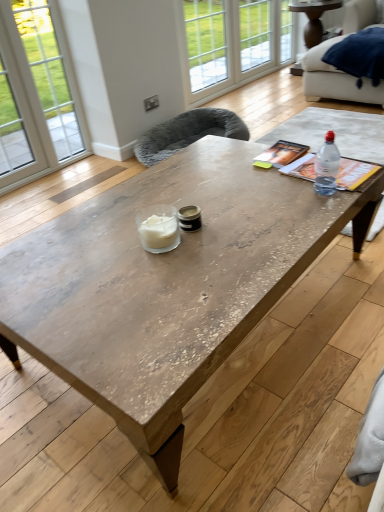
Question: Can you confirm if rustic wood coffee table at center is thinner than clear glass window at upper center, which ranks as the third window in left-to-right order?

Choices:
 (A) yes
 (B) no

Answer: (B)

Question: From the image's perspective, does rustic wood coffee table at center appear lower than clear glass window at upper center, which appears as the first window when viewed from the right?

Choices:
 (A) no
 (B) yes

Answer: (B)

Question: Does rustic wood coffee table at center touch clear glass window at upper center, which ranks as the third window in left-to-right order?

Choices:
 (A) no
 (B) yes

Answer: (A)

Question: Can you confirm if rustic wood coffee table at center is bigger than clear glass window at upper center, which ranks as the third window in left-to-right order?

Choices:
 (A) no
 (B) yes

Answer: (B)

Question: Considering the relative sizes of rustic wood coffee table at center and clear glass window at upper center, which ranks as the third window in left-to-right order, in the image provided, is rustic wood coffee table at center wider than clear glass window at upper center, which ranks as the third window in left-to-right order,?

Choices:
 (A) yes
 (B) no

Answer: (A)

Question: Is clear glass window at upper center, the 1th window viewed from the left, taller or shorter than clear glass window at upper center, which appears as the first window when viewed from the right?

Choices:
 (A) tall
 (B) short

Answer: (A)

Question: From a real-world perspective, is clear glass window at upper center, the 3th window from the right, positioned above or below clear glass window at upper center, which ranks as the third window in left-to-right order?

Choices:
 (A) above
 (B) below

Answer: (A)

Question: Considering the positions of point (198, 77) and point (291, 30), is point (198, 77) closer or farther from the camera than point (291, 30)?

Choices:
 (A) farther
 (B) closer

Answer: (B)

Question: Considering the positions of clear glass window at upper center, the 3th window from the right, and clear glass window at upper center, which ranks as the third window in left-to-right order, in the image, is clear glass window at upper center, the 3th window from the right, wider or thinner than clear glass window at upper center, which ranks as the third window in left-to-right order,?

Choices:
 (A) wide
 (B) thin

Answer: (B)

Question: From a real-world perspective, is clear glass window at upper center, which ranks as the third window in left-to-right order, positioned above or below wooden side table at upper right?

Choices:
 (A) below
 (B) above

Answer: (B)

Question: Based on their sizes in the image, would you say clear glass window at upper center, which appears as the first window when viewed from the right, is bigger or smaller than wooden side table at upper right?

Choices:
 (A) big
 (B) small

Answer: (B)

Question: From the image's perspective, relative to wooden side table at upper right, is clear glass window at upper center, which ranks as the third window in left-to-right order, above or below?

Choices:
 (A) below
 (B) above

Answer: (B)

Question: In terms of height, does clear glass window at upper center, which ranks as the third window in left-to-right order, look taller or shorter compared to wooden side table at upper right?

Choices:
 (A) tall
 (B) short

Answer: (A)

Question: Is clear glass window at upper center, the 2th window from the left, wider or thinner than soft gray fabric armchair at center, the 1th armchair viewed from the left?

Choices:
 (A) thin
 (B) wide

Answer: (A)

Question: In the image, is clear glass window at upper center, which ranks as the second window in right-to-left order, positioned in front of or behind soft gray fabric armchair at center, arranged as the second armchair when viewed from the right?

Choices:
 (A) front
 (B) behind

Answer: (B)